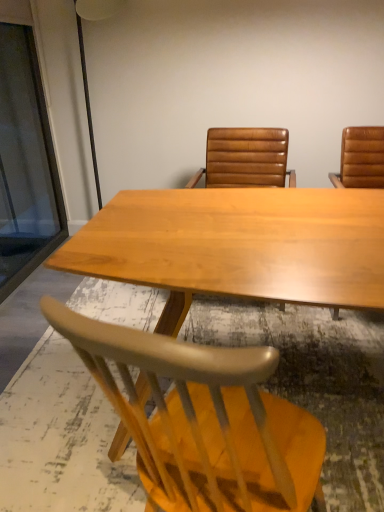
Question: Considering the positions of light wood chair at lower center, positioned as the 2th chair in top-to-bottom order, and light brown wood table at center in the image, is light wood chair at lower center, positioned as the 2th chair in top-to-bottom order, bigger or smaller than light brown wood table at center?

Choices:
 (A) small
 (B) big

Answer: (A)

Question: From a real-world perspective, relative to light brown wood table at center, is light wood chair at lower center, positioned as the 2th chair in top-to-bottom order, vertically above or below?

Choices:
 (A) below
 (B) above

Answer: (A)

Question: Estimate the real-world distances between objects in this image. Which object is farther from the transparent glass door at left?

Choices:
 (A) leather at center, acting as the 1th chair starting from the top
 (B) light wood chair at lower center, the first chair from the bottom
 (C) light brown wood table at center

Answer: (B)

Question: Which of these objects is positioned farthest from the light wood chair at lower center, the first chair from the bottom?

Choices:
 (A) light brown wood table at center
 (B) transparent glass door at left
 (C) leather at center, acting as the 1th chair starting from the top

Answer: (B)